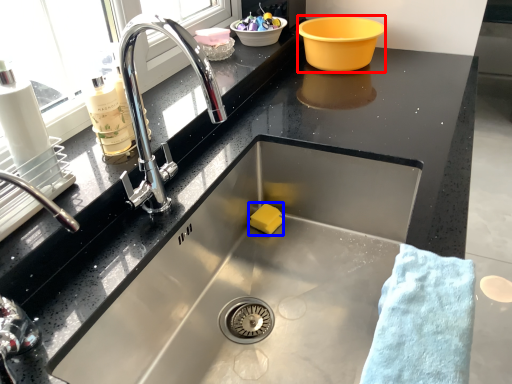
Question: Among these objects, which one is farthest to the camera, basin (highlighted by a red box) or food (highlighted by a blue box)?

Choices:
 (A) basin
 (B) food

Answer: (A)